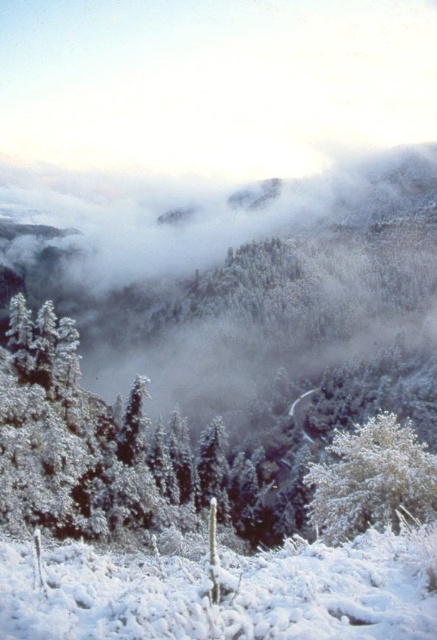
Does white fluffy snow at lower center appear on the right side of white frosty tree at lower right?

In fact, white fluffy snow at lower center is to the left of white frosty tree at lower right.

Does white fluffy snow at lower center have a larger size compared to white frosty tree at lower right?

No.

Locate an element on the screen. white fluffy snow at lower center is located at coordinates (224, 600).